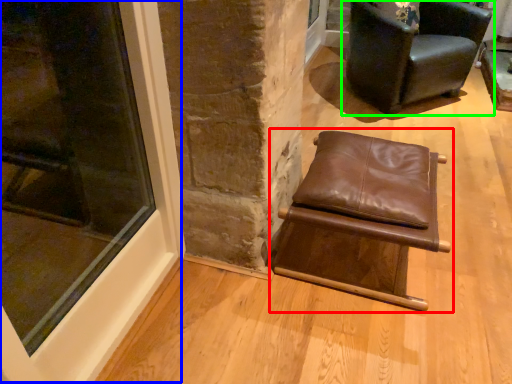
Question: Estimate the real-world distances between objects in this image. Which object is closer to chair (highlighted by a red box), window (highlighted by a blue box) or chair (highlighted by a green box)?

Choices:
 (A) window
 (B) chair

Answer: (A)